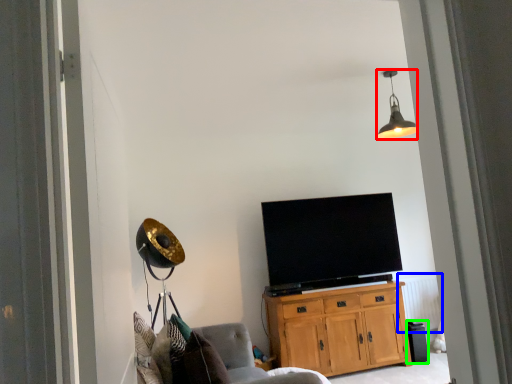
Question: Which object is the closest to the lamp (highlighted by a red box)? Choose among these: radiator (highlighted by a blue box) or trash bin/can (highlighted by a green box).

Choices:
 (A) radiator
 (B) trash bin/can

Answer: (A)